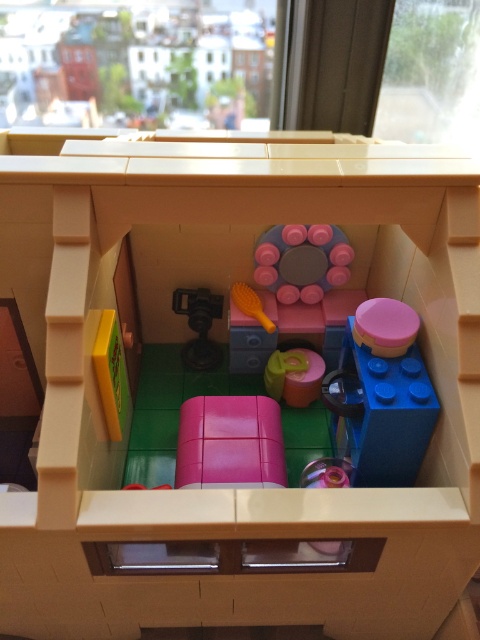
Question: Is matte black camera at center wider than yellow plastic brush at center?

Choices:
 (A) no
 (B) yes

Answer: (B)

Question: Can you confirm if matte pink cupcake at center is thinner than matte black camera at center?

Choices:
 (A) yes
 (B) no

Answer: (B)

Question: Which point is closer to the camera?

Choices:
 (A) (265, 250)
 (B) (216, 417)
 (C) (190, 340)

Answer: (B)

Question: Is matte pink cube at center positioned before pink rubberized circular object at center?

Choices:
 (A) no
 (B) yes

Answer: (B)

Question: Which object is the farthest from the blue plastic cup at center right?

Choices:
 (A) yellow plastic brush at center
 (B) matte pink cupcake at center
 (C) matte black camera at center

Answer: (C)

Question: Among these points, which one is nearest to the camera?

Choices:
 (A) (232, 396)
 (B) (381, 349)

Answer: (B)